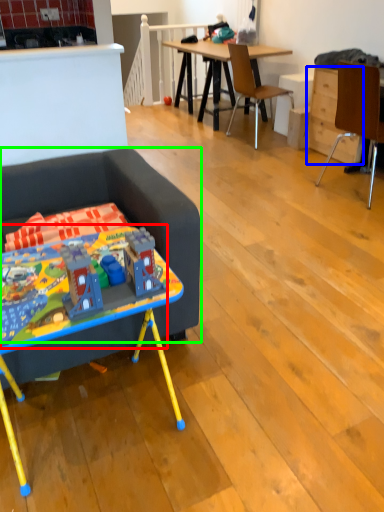
Question: Which is nearer to the toy (highlighted by a red box)? drawer (highlighted by a blue box) or studio couch (highlighted by a green box).

Choices:
 (A) drawer
 (B) studio couch

Answer: (B)